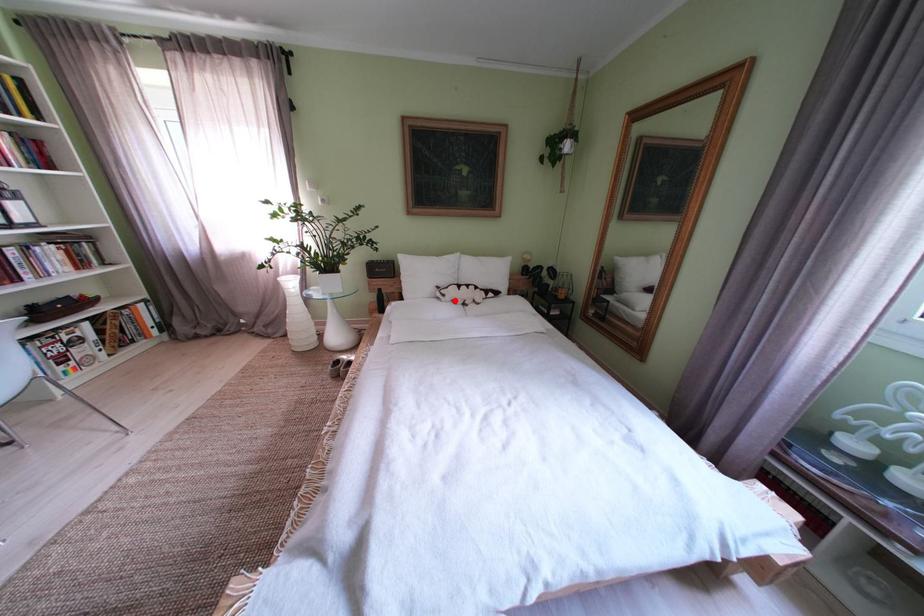
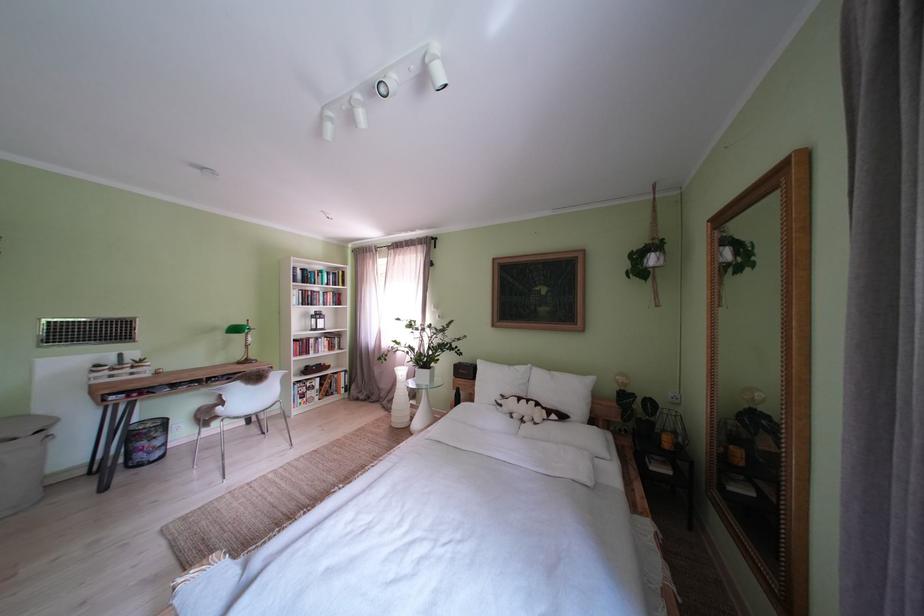
Question: I am providing you with two images of the same scene from different viewpoints. In image1, a red point is highlighted. Considering the same 3D point in image2, which of the following is correct?

Choices:
 (A) It is closer
 (B) It is farther

Answer: (B)